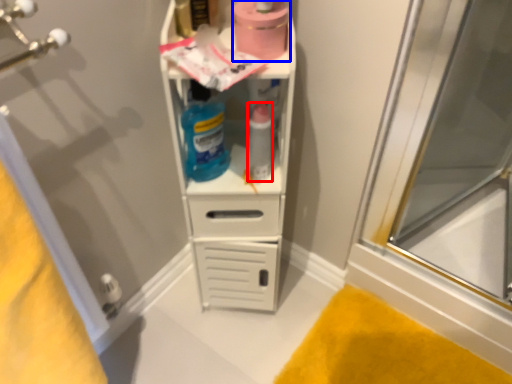
Question: Among these objects, which one is nearest to the camera, bottle (highlighted by a red box) or toilet paper (highlighted by a blue box)?

Choices:
 (A) bottle
 (B) toilet paper

Answer: (B)